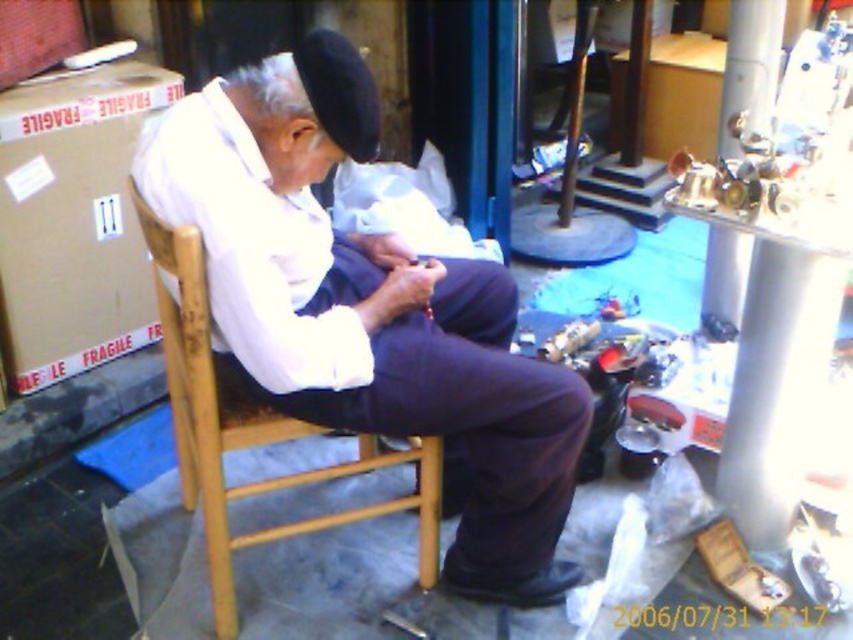
You are a delivery person who needs to place a small package on the floor near the white matte shirt at center. Based on the scene description, can you confirm the exact coordinates where you should place the package?

The white matte shirt at center is located at coordinates point (368, 324), so the package should be placed near those coordinates.

You are organizing items in the workshop and need to stack the brown cardboard box at left and the navy felt hat at upper center. Which item should you place at the bottom to ensure stability?

The brown cardboard box at left has a greater height compared to the navy felt hat at upper center, so placing the taller brown cardboard box at left at the bottom would provide a stable base for stacking.

Consider the image. You are a delivery person who just arrived at this workshop. You need to place a new package on the floor near the brown cardboard box at left without getting too close to the elderly man in the white matte shirt at center. Can you do this? Explain why or why not based on the distance between them.

The white matte shirt at center is 34.05 inches away from the brown cardboard box at left. Since the required distance to avoid getting too close to the elderly man is not specified, but 34.05 inches is a reasonable personal space distance, you can safely place the package near the brown cardboard box at left without encroaching on the man.